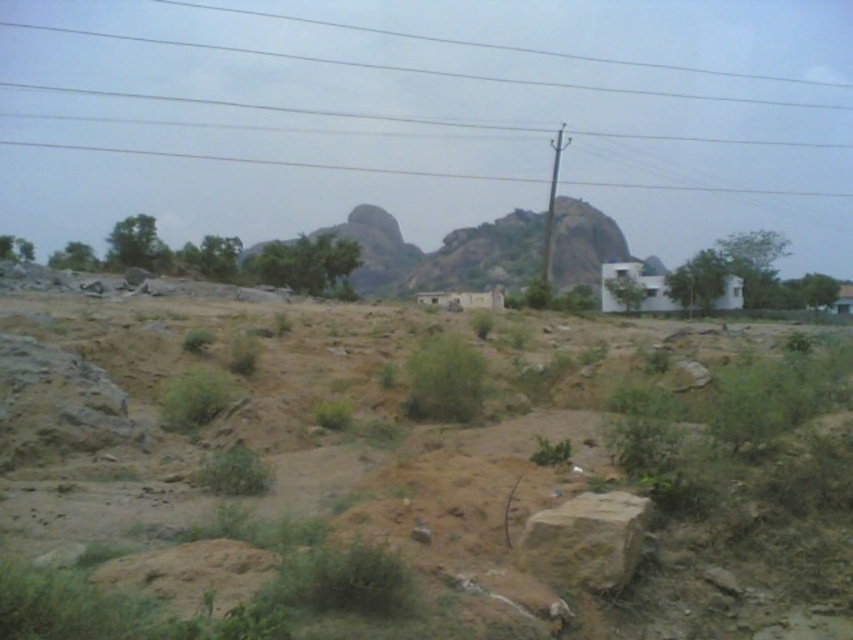
You are a hiker trying to navigate through the rocky terrain. You notice the smooth wire at upper center and the green grass at center. Which of these two landmarks is bigger in size?

The smooth wire at upper center has a larger size compared to the green grass at center, so the smooth wire at upper center is bigger.

You are a drone operator trying to capture aerial shots of the rural landscape. You have two points marked on your map, point 1 at coordinates point (721, 353) and point 2 at coordinates point (461, 76). Which point is closer to your current position as the drone?

Point (721, 353) is closer to the camera than point (461, 76), so the drone is closer to point (721, 353).